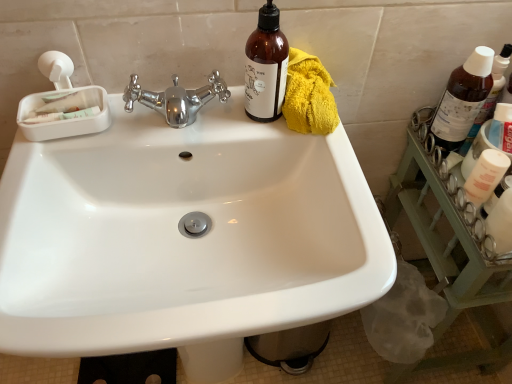
Describe the element at coordinates (309, 96) in the screenshot. Image resolution: width=512 pixels, height=384 pixels. I see `yellow fluffy towel at upper right` at that location.

In order to click on white glossy sink at center in this screenshot , I will do `click(183, 238)`.

The height and width of the screenshot is (384, 512). What do you see at coordinates (266, 67) in the screenshot?
I see `brown glass bottle at upper right, acting as the 3th bottle starting from the right` at bounding box center [266, 67].

You are a GUI agent. You are given a task and a screenshot of the screen. Output one action in this format:
    pyautogui.click(x=<x>, y=<y>)
    Task: Click on the brown glass bottle at upper right, acting as the 3th bottle starting from the right
    This screenshot has width=512, height=384.
    Given the screenshot: What is the action you would take?
    pyautogui.click(x=266, y=67)

Find the location of a particular element. This screenshot has width=512, height=384. yellow fluffy towel at upper right is located at coordinates (309, 96).

In terms of height, does yellow fluffy towel at upper right look taller or shorter compared to brown glass bottle at upper right, acting as the 3th bottle starting from the right?

In the image, yellow fluffy towel at upper right appears to be shorter than brown glass bottle at upper right, acting as the 3th bottle starting from the right.

Would you say yellow fluffy towel at upper right is inside or outside brown glass bottle at upper right, acting as the 3th bottle starting from the right?

yellow fluffy towel at upper right is spatially situated outside brown glass bottle at upper right, acting as the 3th bottle starting from the right.

From the image's perspective, is yellow fluffy towel at upper right located above brown glass bottle at upper right, which is the 1th bottle in left-to-right order?

Actually, yellow fluffy towel at upper right appears below brown glass bottle at upper right, which is the 1th bottle in left-to-right order, in the image.

Considering their positions, is yellow fluffy towel at upper right located in front of or behind brown glass bottle at upper right, which is the 1th bottle in left-to-right order?

Visually, yellow fluffy towel at upper right is located behind brown glass bottle at upper right, which is the 1th bottle in left-to-right order.

In the scene shown: Is brown glass bottle at upper right, placed as the first bottle when sorted from right to left, completely or partially inside yellow fluffy towel at upper right?

No, brown glass bottle at upper right, placed as the first bottle when sorted from right to left, is not a part of yellow fluffy towel at upper right.

From the image's perspective, is yellow fluffy towel at upper right located beneath brown glass bottle at upper right, placed as the first bottle when sorted from right to left?

Yes, from the image's perspective, yellow fluffy towel at upper right is beneath brown glass bottle at upper right, placed as the first bottle when sorted from right to left.

In the image, is yellow fluffy towel at upper right on the left side or the right side of brown glass bottle at upper right, marked as the third bottle in a left-to-right arrangement?

yellow fluffy towel at upper right is to the left of brown glass bottle at upper right, marked as the third bottle in a left-to-right arrangement.

Between yellow fluffy towel at upper right and brown glass bottle at upper right, marked as the third bottle in a left-to-right arrangement, which one has smaller width?

brown glass bottle at upper right, marked as the third bottle in a left-to-right arrangement, is thinner.

Is white glossy sink at center smaller than brown glass bottle at upper right, the second bottle positioned from the left?

No, white glossy sink at center is not smaller than brown glass bottle at upper right, the second bottle positioned from the left.

Considering their positions, is white glossy sink at center located in front of or behind brown glass bottle at upper right, marked as the 2th bottle in a right-to-left arrangement?

white glossy sink at center is in front of brown glass bottle at upper right, marked as the 2th bottle in a right-to-left arrangement.

Which point is more forward, [137,337] or [463,73]?

The point [137,337] is more forward.

Does white glossy sink at center have a lesser width compared to brown glass bottle at upper right, marked as the 2th bottle in a right-to-left arrangement?

Incorrect, the width of white glossy sink at center is not less than that of brown glass bottle at upper right, marked as the 2th bottle in a right-to-left arrangement.

From the image's perspective, is brown glass bottle at upper right, marked as the third bottle in a left-to-right arrangement, below yellow fluffy towel at upper right?

No, from the image's perspective, brown glass bottle at upper right, marked as the third bottle in a left-to-right arrangement, is not below yellow fluffy towel at upper right.

Is brown glass bottle at upper right, placed as the first bottle when sorted from right to left, not near yellow fluffy towel at upper right?

Actually, brown glass bottle at upper right, placed as the first bottle when sorted from right to left, and yellow fluffy towel at upper right are a little close together.

Identify the location of bath towel located below the brown glass bottle at upper right, marked as the third bottle in a left-to-right arrangement (from the image's perspective). This screenshot has height=384, width=512. (309, 96).

Identify the location of bath towel lying on the left of brown glass bottle at upper right, the second bottle positioned from the left. (309, 96).

In terms of width, does brown glass bottle at upper right, the second bottle positioned from the left, look wider or thinner when compared to yellow fluffy towel at upper right?

Clearly, brown glass bottle at upper right, the second bottle positioned from the left, has less width compared to yellow fluffy towel at upper right.

From the picture: From the image's perspective, is brown glass bottle at upper right, the second bottle positioned from the left, over yellow fluffy towel at upper right?

Correct, brown glass bottle at upper right, the second bottle positioned from the left, appears higher than yellow fluffy towel at upper right in the image.

Which object is wider, yellow fluffy towel at upper right or white glossy sink at center?

white glossy sink at center.

From a real-world perspective, relative to white glossy sink at center, is yellow fluffy towel at upper right vertically above or below?

In terms of real-world spatial position, yellow fluffy towel at upper right is above white glossy sink at center.

Considering the sizes of objects yellow fluffy towel at upper right and white glossy sink at center in the image provided, who is shorter, yellow fluffy towel at upper right or white glossy sink at center?

yellow fluffy towel at upper right is shorter.

From the image's perspective, is yellow fluffy towel at upper right located above or below white glossy sink at center?

yellow fluffy towel at upper right is situated higher than white glossy sink at center in the image.

From a real-world perspective, is white glossy sink at center physically located above or below yellow fluffy towel at upper right?

white glossy sink at center is situated lower than yellow fluffy towel at upper right in the real world.

The height and width of the screenshot is (384, 512). In order to click on bath towel on the right of white glossy sink at center in this screenshot , I will do `click(309, 96)`.

From the image's perspective, which one is positioned higher, white glossy sink at center or yellow fluffy towel at upper right?

yellow fluffy towel at upper right is shown above in the image.

Is white glossy sink at center aimed at yellow fluffy towel at upper right?

No.

In the image, there is a brown glass bottle at upper right, acting as the 3th bottle starting from the right. Identify the location of bath towel below it (from the image's perspective). (309, 96).

Where is `the 2nd bottle behind the yellow fluffy towel at upper right`? The width and height of the screenshot is (512, 384). the 2nd bottle behind the yellow fluffy towel at upper right is located at coordinates pyautogui.click(x=490, y=95).

Estimate the real-world distances between objects in this image. Which object is further from yellow fluffy towel at upper right, brown glass bottle at upper right, marked as the 2th bottle in a right-to-left arrangement, or brown glass bottle at upper right, marked as the third bottle in a left-to-right arrangement?

brown glass bottle at upper right, marked as the third bottle in a left-to-right arrangement, lies further to yellow fluffy towel at upper right than the other object.

Looking at the image, which one is located further to brown glass bottle at upper right, acting as the 3th bottle starting from the right, yellow fluffy towel at upper right or brown glass bottle at upper right, placed as the first bottle when sorted from right to left?

brown glass bottle at upper right, placed as the first bottle when sorted from right to left, is further to brown glass bottle at upper right, acting as the 3th bottle starting from the right.

Which object lies further to the anchor point white glossy sink at center, brown glass bottle at upper right, the second bottle positioned from the left, or brown glass bottle at upper right, placed as the first bottle when sorted from right to left?

brown glass bottle at upper right, placed as the first bottle when sorted from right to left, lies further to white glossy sink at center than the other object.

Based on their spatial positions, is brown glass bottle at upper right, placed as the first bottle when sorted from right to left, or brown glass bottle at upper right, the second bottle positioned from the left, further from white glossy sink at center?

The object further to white glossy sink at center is brown glass bottle at upper right, placed as the first bottle when sorted from right to left.

Looking at the image, which one is located closer to white glossy sink at center, brown glass bottle at upper right, placed as the first bottle when sorted from right to left, or brown glass bottle at upper right, acting as the 3th bottle starting from the right?

brown glass bottle at upper right, acting as the 3th bottle starting from the right.

From the image, which object appears to be nearer to white glossy sink at center, yellow fluffy towel at upper right or brown glass bottle at upper right, marked as the 2th bottle in a right-to-left arrangement?

Among the two, yellow fluffy towel at upper right is located nearer to white glossy sink at center.

Looking at the image, which one is located further to brown glass bottle at upper right, which is the 1th bottle in left-to-right order, yellow fluffy towel at upper right or white glossy sink at center?

Based on the image, white glossy sink at center appears to be further to brown glass bottle at upper right, which is the 1th bottle in left-to-right order.

Looking at the image, which one is located closer to brown glass bottle at upper right, the second bottle positioned from the left, white glossy sink at center or yellow fluffy towel at upper right?

yellow fluffy towel at upper right is closer to brown glass bottle at upper right, the second bottle positioned from the left.

You are a GUI agent. You are given a task and a screenshot of the screen. Output one action in this format:
    pyautogui.click(x=<x>, y=<y>)
    Task: Click on the bottle between brown glass bottle at upper right, which is the 1th bottle in left-to-right order, and brown glass bottle at upper right, placed as the first bottle when sorted from right to left, in the horizontal direction
    
    Given the screenshot: What is the action you would take?
    pyautogui.click(x=463, y=99)

Find the location of a particular element. bath towel located between brown glass bottle at upper right, acting as the 3th bottle starting from the right, and brown glass bottle at upper right, placed as the first bottle when sorted from right to left, in the left-right direction is located at coordinates pos(309,96).

The image size is (512, 384). In order to click on bath towel between brown glass bottle at upper right, acting as the 3th bottle starting from the right, and brown glass bottle at upper right, marked as the 2th bottle in a right-to-left arrangement, from left to right in this screenshot , I will do `click(309, 96)`.

At what (x,y) coordinates should I click in order to perform the action: click on bath towel between white glossy sink at center and brown glass bottle at upper right, the second bottle positioned from the left, from left to right. Please return your answer as a coordinate pair (x, y). The image size is (512, 384). Looking at the image, I should click on (309, 96).